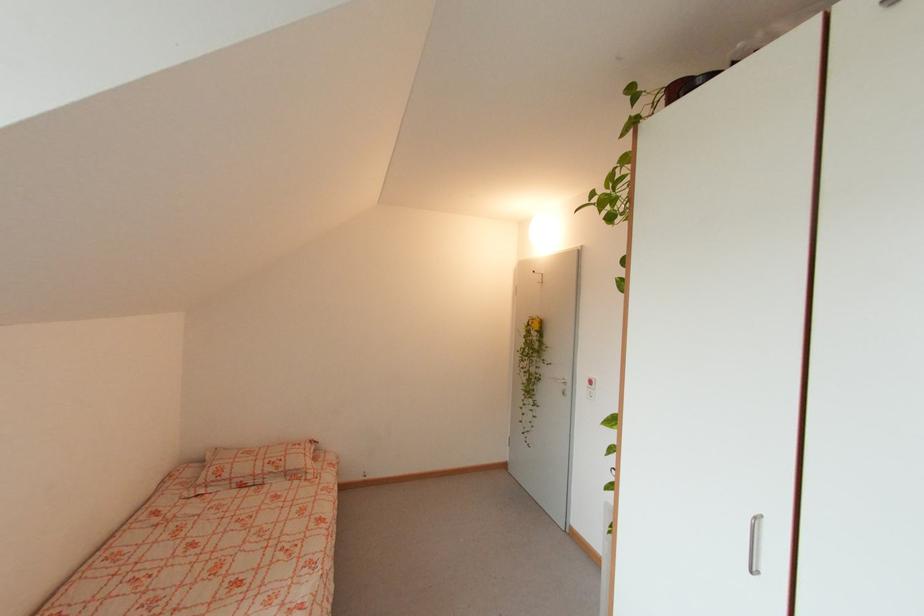
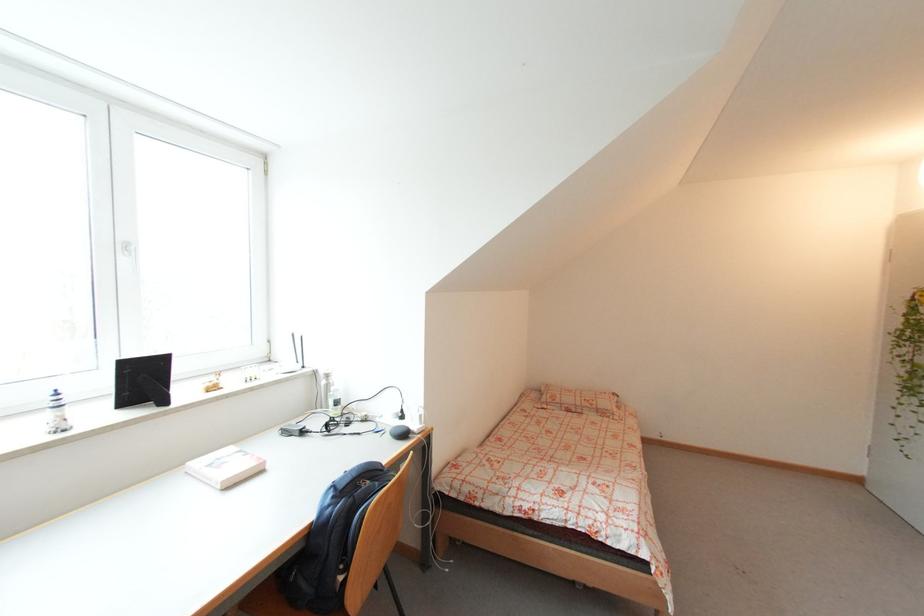
The point at (x=219, y=484) is marked in the first image. Where is the corresponding point in the second image?

(555, 405)